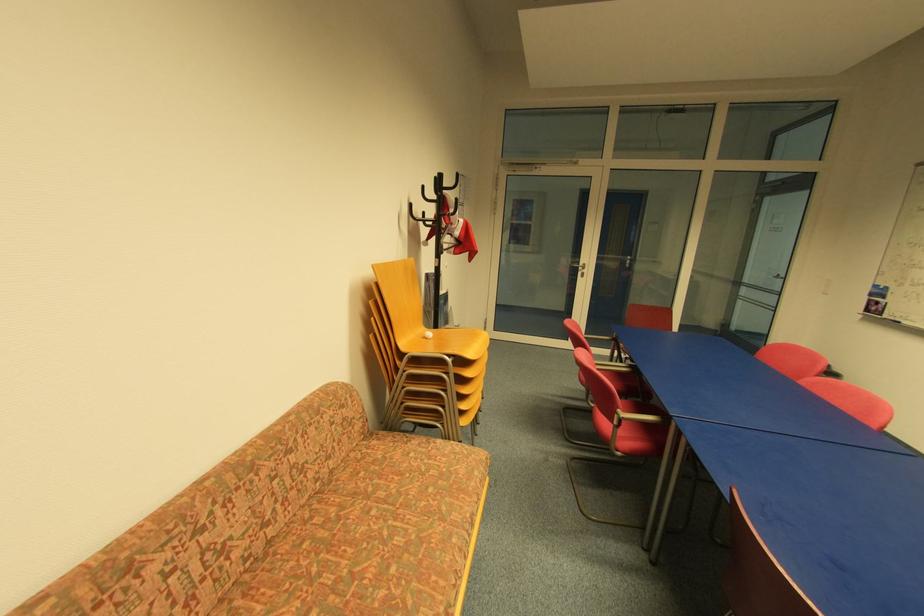
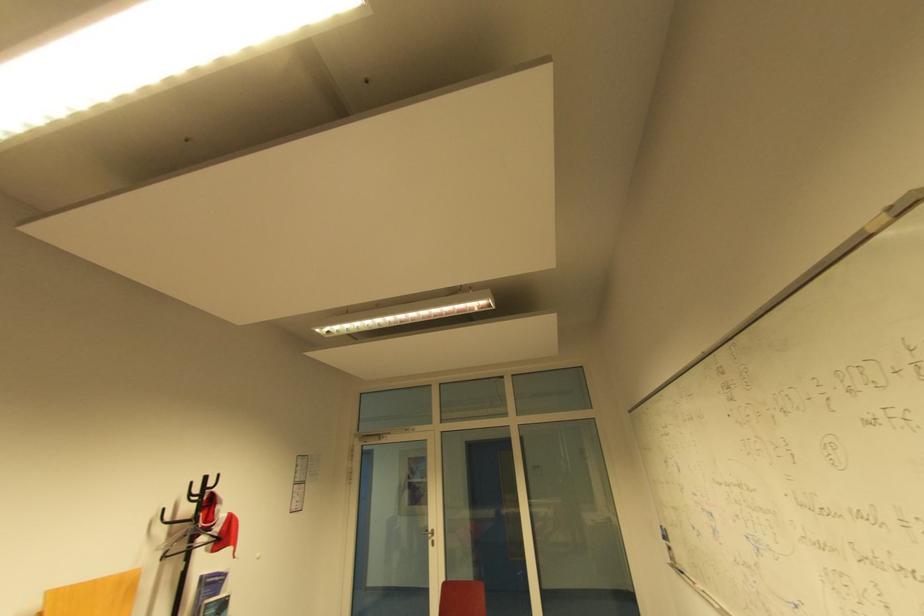
The point at (585, 265) is marked in the first image. Where is the corresponding point in the second image?

(434, 531)